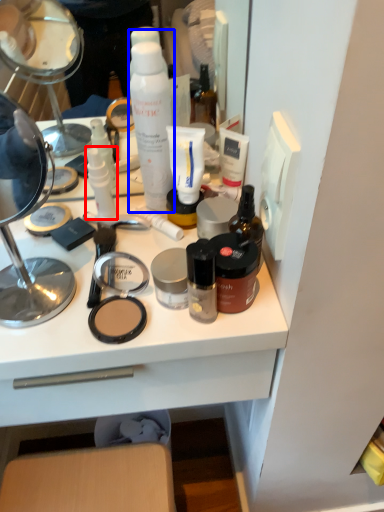
Question: Which object is closer to the camera taking this photo, toiletry (highlighted by a red box) or shaving cream (highlighted by a blue box)?

Choices:
 (A) toiletry
 (B) shaving cream

Answer: (B)